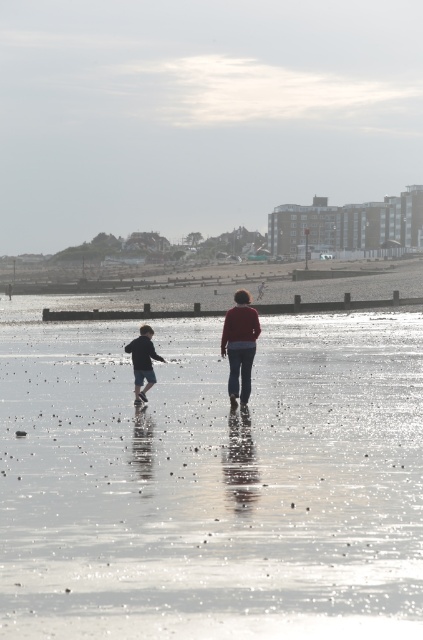
Question: Estimate the real-world distances between objects in this image. Which object is closer to the smooth sand beach at center?

Choices:
 (A) dark blue denim shorts at left
 (B) matte red sweater at center

Answer: (B)

Question: Can you confirm if smooth sand beach at center is positioned below matte red sweater at center?

Choices:
 (A) no
 (B) yes

Answer: (A)

Question: Where is smooth sand beach at center located in relation to dark blue denim shorts at left in the image?

Choices:
 (A) left
 (B) right

Answer: (B)

Question: Is smooth sand beach at center further to the viewer compared to dark blue denim shorts at left?

Choices:
 (A) yes
 (B) no

Answer: (B)

Question: Which point appears closest to the camera in this image?

Choices:
 (A) (329, 500)
 (B) (134, 364)

Answer: (A)

Question: Which object is closer to the camera taking this photo?

Choices:
 (A) matte red sweater at center
 (B) dark blue denim shorts at left
 (C) smooth sand beach at center

Answer: (C)